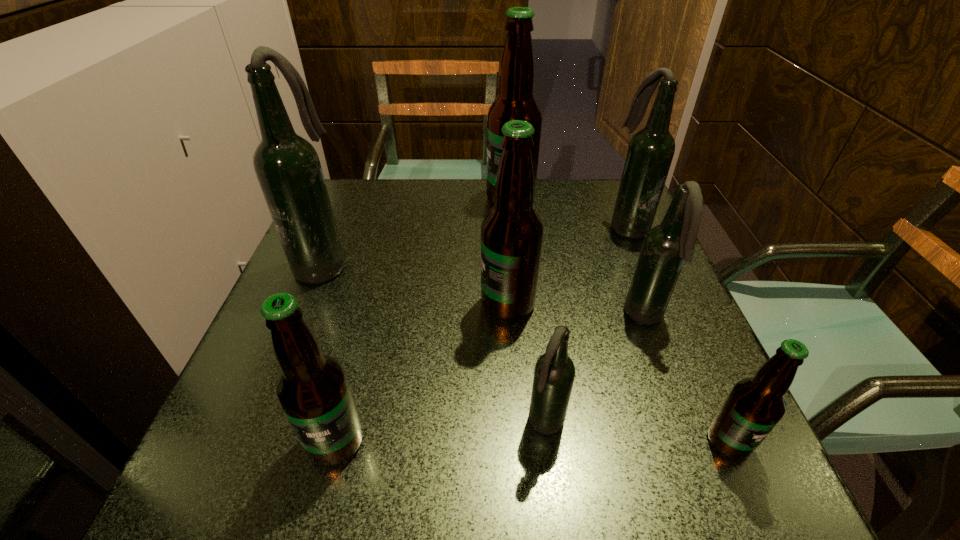
At what (x,y) coordinates should I click in order to perform the action: click on free point between the third dark beer bottle from right to left and the smallest brown beer bottle. Please return your answer as a coordinate pair (x, y). Image resolution: width=960 pixels, height=540 pixels. Looking at the image, I should click on (637, 433).

What are the coordinates of `object identified as the seventh closest to the farthest brown beer bottle` in the screenshot? It's located at (754, 406).

Select which object appears as the third closest to the second dark beer bottle from left to right. Please provide its 2D coordinates. Your answer should be formatted as a tuple, i.e. [(x, y)], where the tuple contains the x and y coordinates of a point satisfying the conditions above.

[(754, 406)]

Point out which beer bottle is positioned as the fifth nearest to the second biggest brown beer bottle. Please provide its 2D coordinates. Your answer should be formatted as a tuple, i.e. [(x, y)], where the tuple contains the x and y coordinates of a point satisfying the conditions above.

[(515, 101)]

Locate an element on the screen. This screenshot has height=540, width=960. the sixth closest beer bottle to the second nearest dark beer bottle is located at coordinates (312, 389).

Point out which brown beer bottle is positioned as the third nearest to the smallest brown beer bottle. Please provide its 2D coordinates. Your answer should be formatted as a tuple, i.e. [(x, y)], where the tuple contains the x and y coordinates of a point satisfying the conditions above.

[(515, 101)]

Identify which brown beer bottle is the second closest to the leftmost dark beer bottle. Please provide its 2D coordinates. Your answer should be formatted as a tuple, i.e. [(x, y)], where the tuple contains the x and y coordinates of a point satisfying the conditions above.

[(312, 389)]

The image size is (960, 540). Identify the location of dark beer bottle object that ranks as the third closest to the second smallest dark beer bottle. (287, 166).

What are the coordinates of `dark beer bottle that is the fourth closest to the seventh beer bottle from right to left` in the screenshot? It's located at coord(651,150).

At what (x,y) coordinates should I click in order to perform the action: click on free space that satisfies the following two spatial constraints: 1. on the label of the second farthest beer bottle; 2. on the right side of the farthest beer bottle. Please return your answer as a coordinate pair (x, y). The height and width of the screenshot is (540, 960). Looking at the image, I should click on (514, 226).